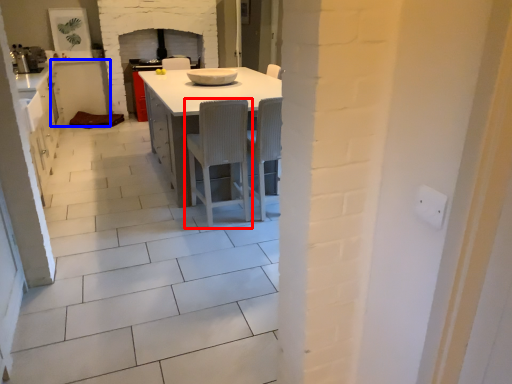
Question: Among these objects, which one is nearest to the camera, chair (highlighted by a red box) or cabinetry (highlighted by a blue box)?

Choices:
 (A) chair
 (B) cabinetry

Answer: (A)